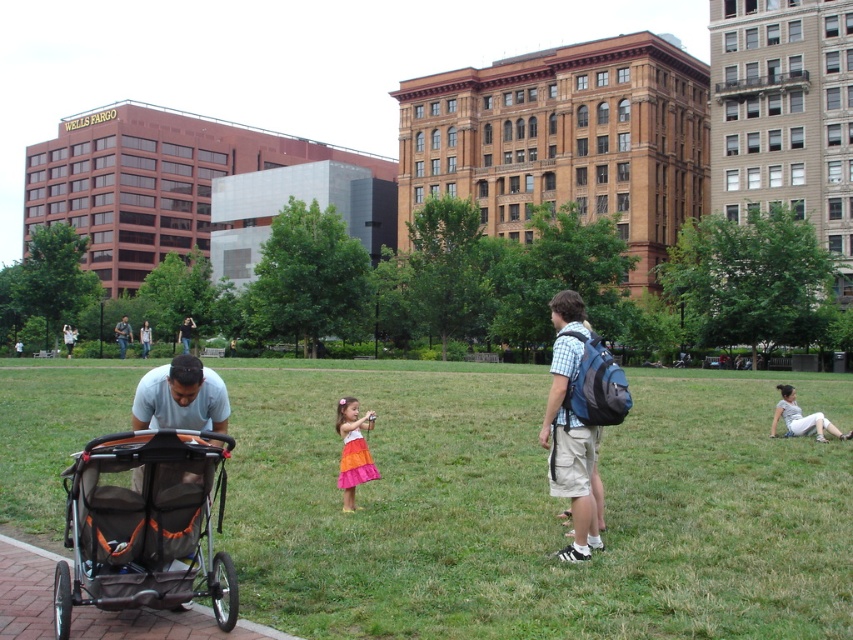
Does green grass at center have a greater width compared to orange mesh baby carriage at lower left?

Yes.

Does green grass at center appear over orange mesh baby carriage at lower left?

No, green grass at center is not above orange mesh baby carriage at lower left.

At what (x,y) coordinates should I click in order to perform the action: click on green grass at center. Please return your answer as a coordinate pair (x, y). The height and width of the screenshot is (640, 853). Looking at the image, I should click on point(535,506).

You are a GUI agent. You are given a task and a screenshot of the screen. Output one action in this format:
    pyautogui.click(x=<x>, y=<y>)
    Task: Click on the green grass at center
    
    Given the screenshot: What is the action you would take?
    pyautogui.click(x=535, y=506)

Who is taller, blue plaid shirt at center or blue denim jeans at center?

With more height is blue denim jeans at center.

Looking at this image, does blue plaid shirt at center appear under blue denim jeans at center?

Yes, blue plaid shirt at center is below blue denim jeans at center.

The width and height of the screenshot is (853, 640). Identify the location of blue plaid shirt at center. (570, 429).

Is point (669, 598) more distant than point (354, 508)?

No.

This screenshot has height=640, width=853. Identify the location of green grass at center. (535, 506).

Where is `green grass at center`? The height and width of the screenshot is (640, 853). green grass at center is located at coordinates (535, 506).